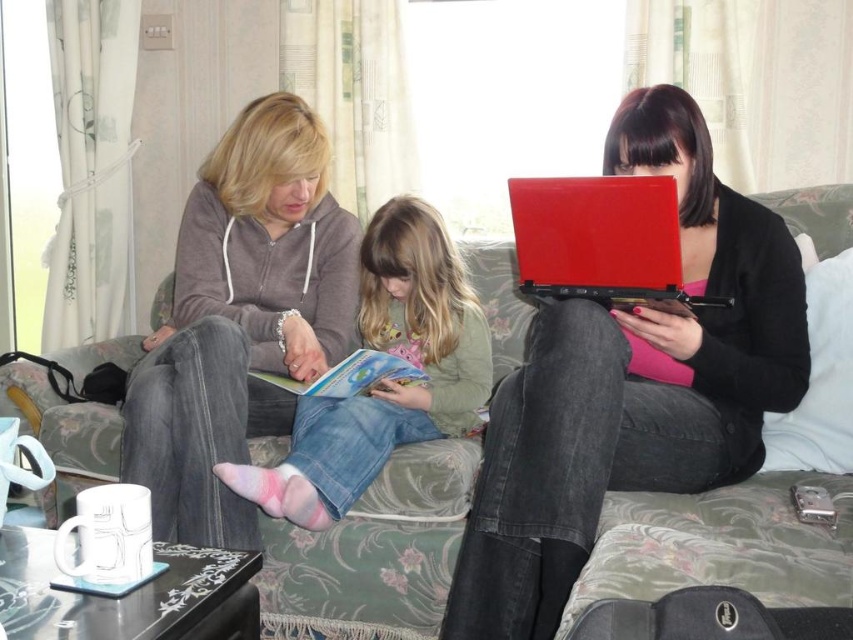
Does floral fabric couch at center have a greater height compared to matte red laptop at center right?

Indeed, floral fabric couch at center has a greater height compared to matte red laptop at center right.

Can you confirm if floral fabric couch at center is shorter than matte red laptop at center right?

In fact, floral fabric couch at center may be taller than matte red laptop at center right.

Between point (708, 525) and point (511, 192), which one is positioned behind?

Positioned behind is point (511, 192).

You are a GUI agent. You are given a task and a screenshot of the screen. Output one action in this format:
    pyautogui.click(x=<x>, y=<y>)
    Task: Click on the floral fabric couch at center
    
    Given the screenshot: What is the action you would take?
    pyautogui.click(x=373, y=554)

Is matte red laptop at center positioned behind denim jeans at center?

No, matte red laptop at center is closer to the viewer.

Does matte red laptop at center have a greater height compared to denim jeans at center?

Indeed, matte red laptop at center has a greater height compared to denim jeans at center.

Does point (584, 548) come behind point (463, 310)?

That is False.

Locate an element on the screen. Image resolution: width=853 pixels, height=640 pixels. matte red laptop at center is located at coordinates (631, 387).

Is floral fabric couch at center shorter than matte plastic book at center?

No, floral fabric couch at center is not shorter than matte plastic book at center.

Does floral fabric couch at center have a larger size compared to matte plastic book at center?

Correct, floral fabric couch at center is larger in size than matte plastic book at center.

The height and width of the screenshot is (640, 853). I want to click on floral fabric couch at center, so click(x=373, y=554).